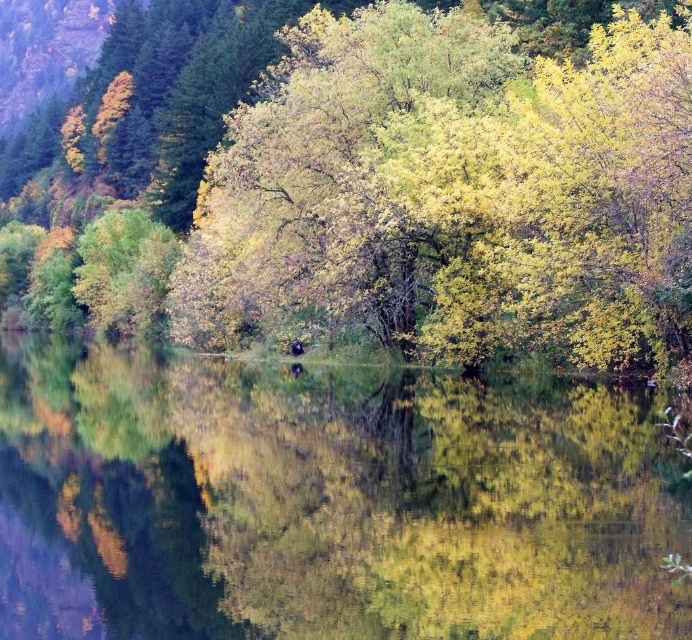
Question: Which object appears farthest from the camera in this image?

Choices:
 (A) green reflective water at center
 (B) yellow-green foliage at center

Answer: (B)

Question: Which of the following is the farthest from the observer?

Choices:
 (A) green reflective water at center
 (B) yellow-green foliage at center

Answer: (B)

Question: Does green reflective water at center have a greater width compared to yellow-green foliage at center?

Choices:
 (A) no
 (B) yes

Answer: (A)

Question: Can you confirm if green reflective water at center is thinner than yellow-green foliage at center?

Choices:
 (A) no
 (B) yes

Answer: (B)

Question: Among these points, which one is farthest from the camera?

Choices:
 (A) (390, 12)
 (B) (318, 458)

Answer: (A)

Question: Does green reflective water at center appear over yellow-green foliage at center?

Choices:
 (A) no
 (B) yes

Answer: (A)